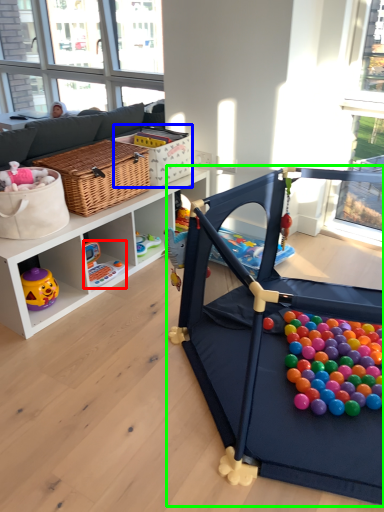
Question: Considering the real-world distances, which object is closest to toy (highlighted by a red box)? basket (highlighted by a blue box) or toy (highlighted by a green box).

Choices:
 (A) basket
 (B) toy

Answer: (A)